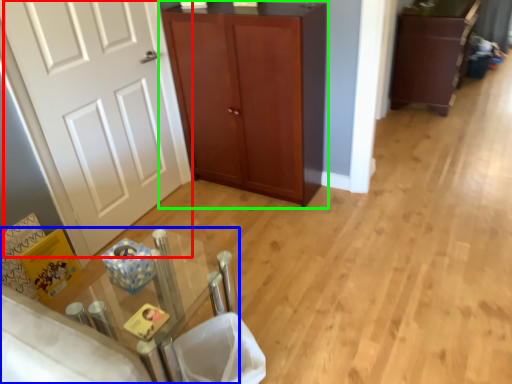
Question: Which object is the closest to the door (highlighted by a red box)? Choose among these: table (highlighted by a blue box) or cupboard (highlighted by a green box).

Choices:
 (A) table
 (B) cupboard

Answer: (B)